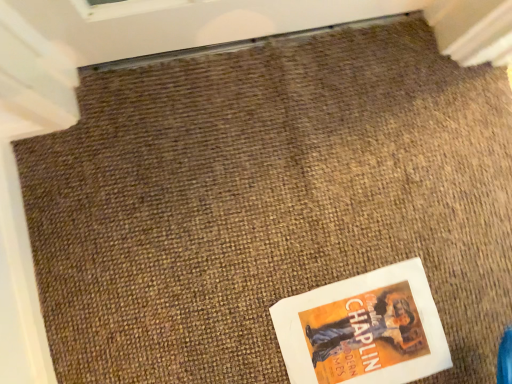
Describe the element at coordinates (362, 329) in the screenshot. The width and height of the screenshot is (512, 384). I see `orange paper poster at lower right` at that location.

At what (x,y) coordinates should I click in order to perform the action: click on orange paper poster at lower right. Please return your answer as a coordinate pair (x, y). The width and height of the screenshot is (512, 384). Looking at the image, I should click on (362, 329).

Locate an element on the screen. orange paper poster at lower right is located at coordinates (362, 329).